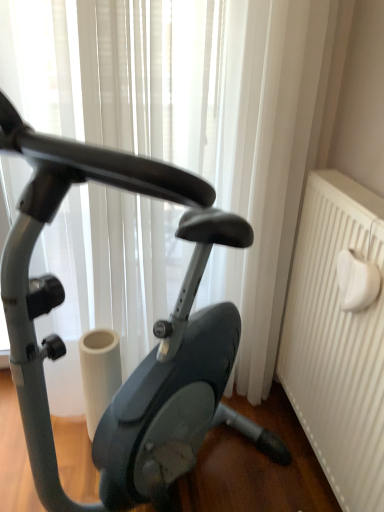
Question: Considering the positions of point (163, 455) and point (380, 245), is point (163, 455) closer or farther from the camera than point (380, 245)?

Choices:
 (A) farther
 (B) closer

Answer: (A)

Question: Is matte black stationary bicycle at center in front of or behind white textured radiator at right in the image?

Choices:
 (A) front
 (B) behind

Answer: (A)

Question: Is matte black stationary bicycle at center situated inside white textured radiator at right or outside?

Choices:
 (A) outside
 (B) inside

Answer: (A)

Question: In the image, is white textured radiator at right positioned in front of or behind matte black stationary bicycle at center?

Choices:
 (A) behind
 (B) front

Answer: (A)

Question: Is white textured radiator at right wider or thinner than matte black stationary bicycle at center?

Choices:
 (A) wide
 (B) thin

Answer: (B)

Question: Based on their sizes in the image, would you say white textured radiator at right is bigger or smaller than matte black stationary bicycle at center?

Choices:
 (A) small
 (B) big

Answer: (A)

Question: From the image's perspective, is white textured radiator at right above or below matte black stationary bicycle at center?

Choices:
 (A) above
 (B) below

Answer: (B)